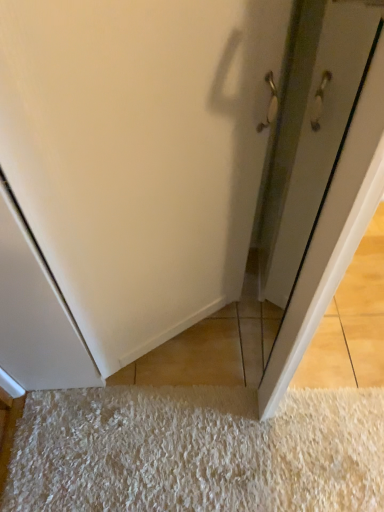
Question: Does point (258, 406) appear closer or farther from the camera than point (233, 479)?

Choices:
 (A) farther
 (B) closer

Answer: (A)

Question: Is white glossy door at center taller or shorter than white shaggy rug at lower center?

Choices:
 (A) tall
 (B) short

Answer: (A)

Question: In the image, is white glossy door at center on the left side or the right side of white shaggy rug at lower center?

Choices:
 (A) left
 (B) right

Answer: (B)

Question: Considering the positions of point (49, 456) and point (317, 313), is point (49, 456) closer or farther from the camera than point (317, 313)?

Choices:
 (A) farther
 (B) closer

Answer: (A)

Question: Is white shaggy rug at lower center to the left or to the right of white glossy door at center in the image?

Choices:
 (A) left
 (B) right

Answer: (A)

Question: In terms of height, does white shaggy rug at lower center look taller or shorter compared to white glossy door at center?

Choices:
 (A) tall
 (B) short

Answer: (B)

Question: Relative to white glossy door at center, is white shaggy rug at lower center in front or behind?

Choices:
 (A) behind
 (B) front

Answer: (A)